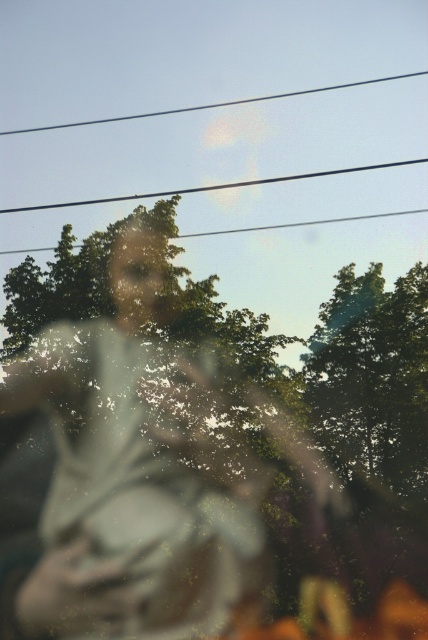
In the scene shown: Who is positioned more to the left, clear wire at upper center or smooth wire at upper center?

A: From the viewer's perspective, smooth wire at upper center appears more on the left side.

Is clear wire at upper center further to camera compared to smooth wire at upper center?

No, clear wire at upper center is in front of smooth wire at upper center.

The image size is (428, 640). In order to click on clear wire at upper center in this screenshot , I will do `click(213, 186)`.

Find the location of a particular element. The image size is (428, 640). clear wire at upper center is located at coordinates (213, 186).

Is translucent glass figure at center positioned in front of smooth wire at upper center?

Yes, translucent glass figure at center is closer to the viewer.

Does translucent glass figure at center have a larger size compared to smooth wire at upper center?

Correct, translucent glass figure at center is larger in size than smooth wire at upper center.

Which is in front, point (222, 438) or point (211, 104)?

Point (222, 438) is more forward.

Image resolution: width=428 pixels, height=640 pixels. In order to click on translucent glass figure at center in this screenshot , I will do `click(136, 445)`.

Can you confirm if translucent glass figure at center is positioned to the left of clear wire at upper center?

Indeed, translucent glass figure at center is positioned on the left side of clear wire at upper center.

Measure the distance between translucent glass figure at center and camera.

They are 27.11 meters apart.

Image resolution: width=428 pixels, height=640 pixels. I want to click on translucent glass figure at center, so click(136, 445).